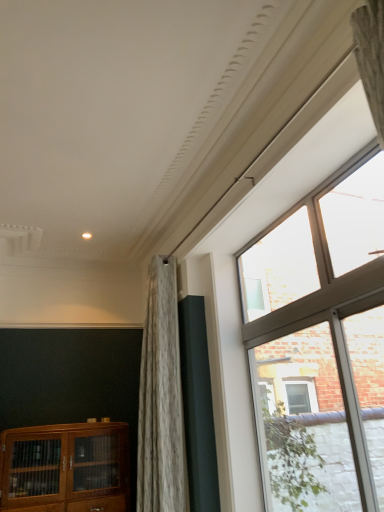
Locate an element on the screen. This screenshot has width=384, height=512. clear glass window at upper right is located at coordinates (323, 347).

This screenshot has width=384, height=512. What do you see at coordinates (323, 347) in the screenshot? I see `clear glass window at upper right` at bounding box center [323, 347].

In order to face clear glass window at upper right, should I rotate leftwards or rightwards?

Answer: Rotate right and turn 13.962 degrees.

Locate an element on the screen. This screenshot has height=512, width=384. wooden cabinet at lower left is located at coordinates (65, 468).

In order to face wooden cabinet at lower left, should I rotate leftwards or rightwards?

Turn left approximately 16.907 degrees to face it.

This screenshot has width=384, height=512. Describe the element at coordinates (65, 468) in the screenshot. I see `wooden cabinet at lower left` at that location.

This screenshot has width=384, height=512. I want to click on clear glass window at upper right, so click(323, 347).

Is clear glass window at upper right at the left side of wooden cabinet at lower left?

No.

Considering their positions, is clear glass window at upper right located in front of or behind wooden cabinet at lower left?

Visually, clear glass window at upper right is located in front of wooden cabinet at lower left.

Which is further, (x=362, y=152) or (x=61, y=428)?

The point (x=61, y=428) is more distant.

From the image's perspective, would you say clear glass window at upper right is shown under wooden cabinet at lower left?

Incorrect, from the image's perspective, clear glass window at upper right is higher than wooden cabinet at lower left.

From a real-world perspective, which is physically above, clear glass window at upper right or wooden cabinet at lower left?

clear glass window at upper right.

Between clear glass window at upper right and wooden cabinet at lower left, which one has smaller width?

With smaller width is clear glass window at upper right.

Based on the photo, considering the relative sizes of clear glass window at upper right and wooden cabinet at lower left in the image provided, is clear glass window at upper right taller than wooden cabinet at lower left?

In fact, clear glass window at upper right may be shorter than wooden cabinet at lower left.

Considering the relative sizes of clear glass window at upper right and wooden cabinet at lower left in the image provided, is clear glass window at upper right smaller than wooden cabinet at lower left?

Indeed, clear glass window at upper right has a smaller size compared to wooden cabinet at lower left.

Would you say clear glass window at upper right is outside wooden cabinet at lower left?

Yes, clear glass window at upper right is outside of wooden cabinet at lower left.

Are clear glass window at upper right and wooden cabinet at lower left far apart?

Indeed, clear glass window at upper right is not near wooden cabinet at lower left.

Is clear glass window at upper right oriented towards wooden cabinet at lower left?

No, clear glass window at upper right is not facing towards wooden cabinet at lower left.

Locate an element on the screen. This screenshot has height=512, width=384. window located on the right of wooden cabinet at lower left is located at coordinates (323, 347).

Which object is positioned more to the left, wooden cabinet at lower left or clear glass window at upper right?

From the viewer's perspective, wooden cabinet at lower left appears more on the left side.

Which object is further away from the camera taking this photo, wooden cabinet at lower left or clear glass window at upper right?

wooden cabinet at lower left is further from the camera.

Which is farther from the camera, (x=92, y=441) or (x=365, y=212)?

The point (x=92, y=441) is behind.

From the image's perspective, which one is positioned lower, wooden cabinet at lower left or clear glass window at upper right?

From the image's view, wooden cabinet at lower left is below.

Consider the image. From a real-world perspective, relative to clear glass window at upper right, is wooden cabinet at lower left vertically above or below?

From a real-world perspective, wooden cabinet at lower left is physically below clear glass window at upper right.

In the scene shown: Considering the relative sizes of wooden cabinet at lower left and clear glass window at upper right in the image provided, is wooden cabinet at lower left wider than clear glass window at upper right?

Correct, the width of wooden cabinet at lower left exceeds that of clear glass window at upper right.

Considering the sizes of wooden cabinet at lower left and clear glass window at upper right in the image, is wooden cabinet at lower left taller or shorter than clear glass window at upper right?

Considering their sizes, wooden cabinet at lower left has more height than clear glass window at upper right.

Based on the photo, considering the sizes of objects wooden cabinet at lower left and clear glass window at upper right in the image provided, who is smaller, wooden cabinet at lower left or clear glass window at upper right?

clear glass window at upper right is smaller.

Consider the image. Which is correct: wooden cabinet at lower left is inside clear glass window at upper right, or outside of it?

wooden cabinet at lower left cannot be found inside clear glass window at upper right.

Is wooden cabinet at lower left far from clear glass window at upper right?

wooden cabinet at lower left is positioned a significant distance from clear glass window at upper right.

Does wooden cabinet at lower left turn towards clear glass window at upper right?

No, wooden cabinet at lower left does not turn towards clear glass window at upper right.

This screenshot has height=512, width=384. What are the coordinates of `window that is on the right side of wooden cabinet at lower left` in the screenshot? It's located at (323, 347).

I want to click on window positioned vertically above the wooden cabinet at lower left (from a real-world perspective), so click(323, 347).

Locate an element on the screen. The image size is (384, 512). window lying above the wooden cabinet at lower left (from the image's perspective) is located at coordinates (323, 347).